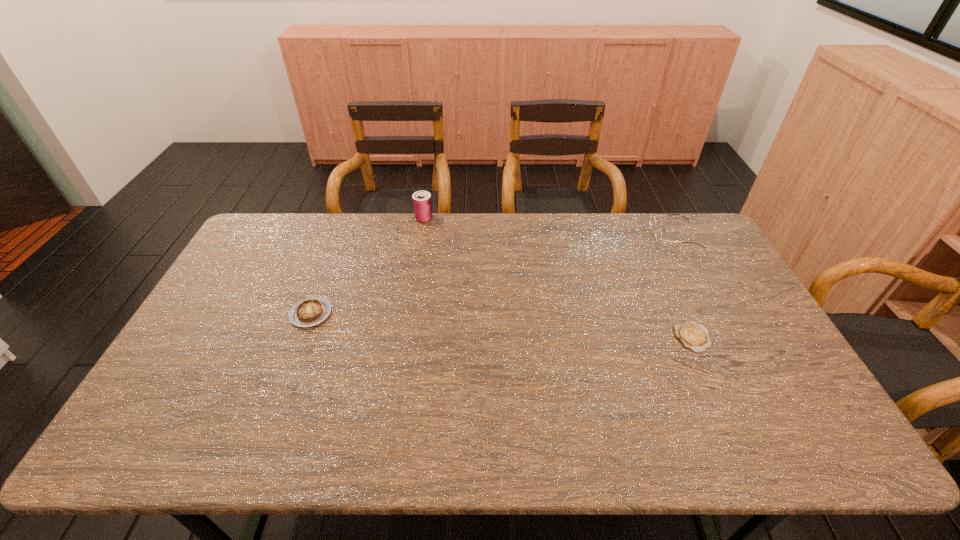
Where is `free point between the shortest object and the taller quiche`? The image size is (960, 540). free point between the shortest object and the taller quiche is located at coordinates (501, 326).

This screenshot has width=960, height=540. What are the coordinates of `vacant point located between the spectacles and the can` in the screenshot? It's located at (549, 226).

Identify the location of vacant space in between the right quiche and the third tallest object. (501, 326).

Find the location of a particular element. The height and width of the screenshot is (540, 960). object that stands as the second closest to the spectacles is located at coordinates (422, 204).

Find the location of `object that is the second nearest to the third shortest object`. object that is the second nearest to the third shortest object is located at coordinates (422, 204).

Where is `free region that satisfies the following two spatial constraints: 1. through the lenses of the second tallest object; 2. on the front side of the taller quiche`? This screenshot has height=540, width=960. free region that satisfies the following two spatial constraints: 1. through the lenses of the second tallest object; 2. on the front side of the taller quiche is located at coordinates click(x=717, y=314).

Find the location of a particular element. The image size is (960, 540). free space that satisfies the following two spatial constraints: 1. on the front side of the right quiche; 2. on the left side of the can is located at coordinates (405, 337).

This screenshot has height=540, width=960. In order to click on blank area in the image that satisfies the following two spatial constraints: 1. through the lenses of the spectacles; 2. on the front side of the shortest object in this screenshot , I will do `click(729, 337)`.